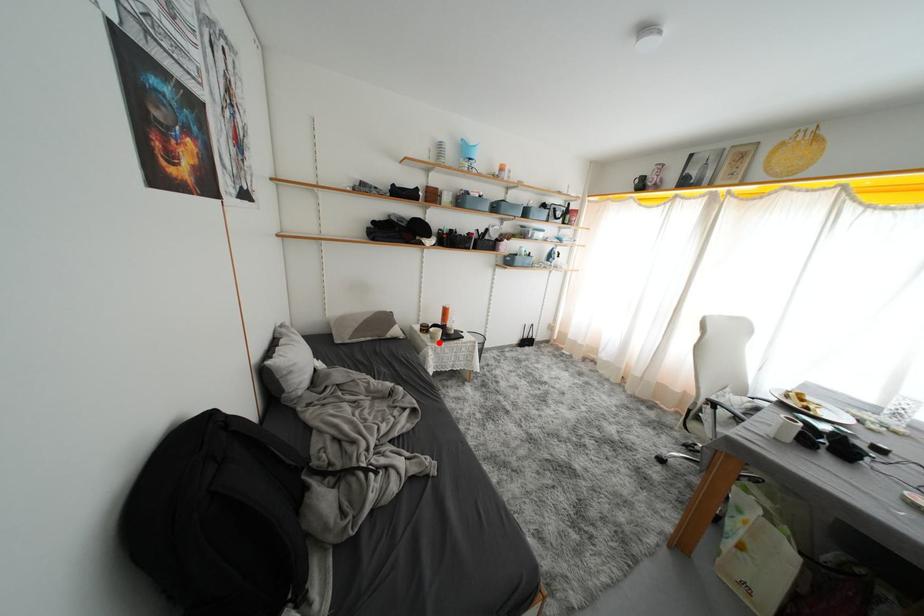
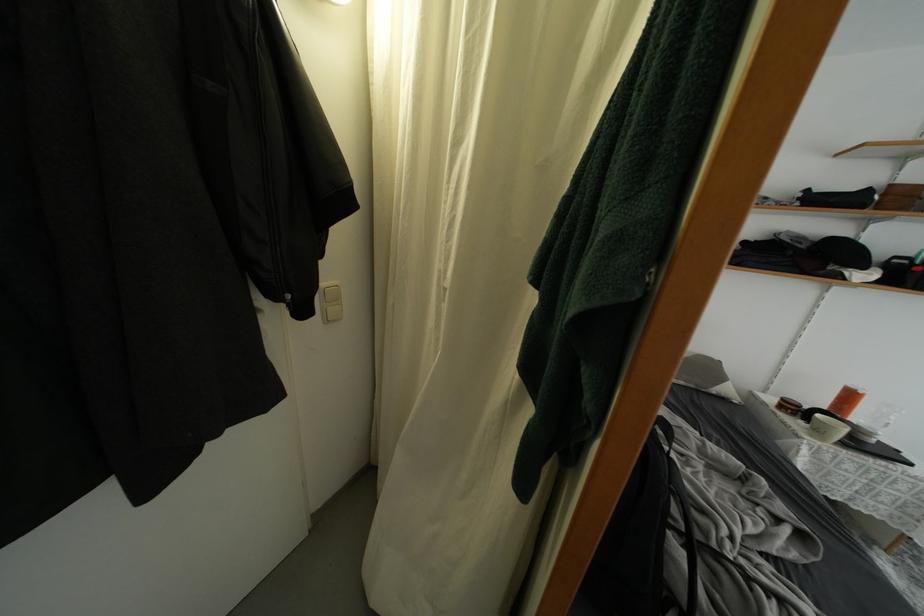
Locate, in the second image, the point that corresponds to the highlighted location in the first image.

(823, 437)